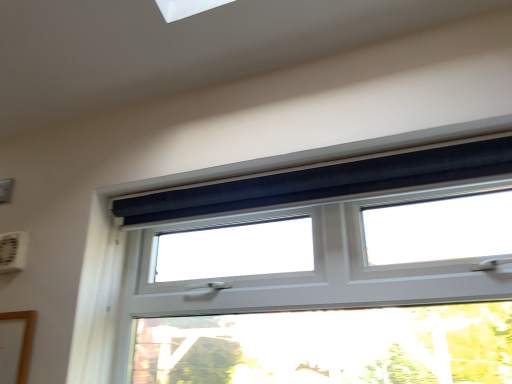
Measure the distance between point (1, 253) and camera.

Point (1, 253) and camera are 1.39 meters apart.

In order to face white plastic air conditioning unit at upper left, should I rotate leftwards or rightwards?

Rotate your view left by about 30.330°.

This screenshot has width=512, height=384. I want to click on white plastic air conditioning unit at upper left, so pyautogui.click(x=13, y=251).

This screenshot has width=512, height=384. What do you see at coordinates (13, 251) in the screenshot?
I see `white plastic air conditioning unit at upper left` at bounding box center [13, 251].

The image size is (512, 384). What are the coordinates of `black velvet curtain at upper center` in the screenshot? It's located at (323, 272).

Based on the photo, measure the distance between point (162,254) and camera.

A distance of 4.78 feet exists between point (162,254) and camera.

In order to face black velvet curtain at upper center, should I rotate leftwards or rightwards?

Rotate right and turn 5.885 degrees.

This screenshot has width=512, height=384. Describe the element at coordinates (323, 272) in the screenshot. I see `black velvet curtain at upper center` at that location.

Where is `white plastic air conditioning unit at upper left`? Image resolution: width=512 pixels, height=384 pixels. white plastic air conditioning unit at upper left is located at coordinates (13, 251).

Considering the positions of objects white plastic air conditioning unit at upper left and black velvet curtain at upper center in the image provided, who is more to the right, white plastic air conditioning unit at upper left or black velvet curtain at upper center?

From the viewer's perspective, black velvet curtain at upper center appears more on the right side.

Is white plastic air conditioning unit at upper left positioned in front of black velvet curtain at upper center?

No, white plastic air conditioning unit at upper left is further to the viewer.

Which point is more forward, [1,255] or [486,356]?

The point [486,356] is more forward.

From the image's perspective, who appears lower, white plastic air conditioning unit at upper left or black velvet curtain at upper center?

black velvet curtain at upper center is shown below in the image.

From a real-world perspective, which object rests below the other?

black velvet curtain at upper center, from a real-world perspective.

Which of these two, white plastic air conditioning unit at upper left or black velvet curtain at upper center, is wider?

With larger width is black velvet curtain at upper center.

In the scene shown: In terms of height, does white plastic air conditioning unit at upper left look taller or shorter compared to black velvet curtain at upper center?

Clearly, white plastic air conditioning unit at upper left is shorter compared to black velvet curtain at upper center.

Is white plastic air conditioning unit at upper left smaller than black velvet curtain at upper center?

Yes, white plastic air conditioning unit at upper left is smaller than black velvet curtain at upper center.

Choose the correct answer: Is white plastic air conditioning unit at upper left inside black velvet curtain at upper center or outside it?

white plastic air conditioning unit at upper left is located beyond the bounds of black velvet curtain at upper center.

Is the surface of white plastic air conditioning unit at upper left in direct contact with black velvet curtain at upper center?

white plastic air conditioning unit at upper left and black velvet curtain at upper center are not in contact.

Based on the photo, is white plastic air conditioning unit at upper left facing away from black velvet curtain at upper center?

white plastic air conditioning unit at upper left is not turned away from black velvet curtain at upper center.

Could you measure the distance between white plastic air conditioning unit at upper left and black velvet curtain at upper center?

They are 33.80 inches apart.

The width and height of the screenshot is (512, 384). I want to click on window below the white plastic air conditioning unit at upper left (from the image's perspective), so click(x=323, y=272).

Is black velvet curtain at upper center to the left or to the right of white plastic air conditioning unit at upper left in the image?

Based on their positions, black velvet curtain at upper center is located to the right of white plastic air conditioning unit at upper left.

In the scene shown: Which object is further away from the camera, black velvet curtain at upper center or white plastic air conditioning unit at upper left?

white plastic air conditioning unit at upper left is further from the camera.

Which is behind, point (248, 355) or point (23, 249)?

The point (23, 249) is farther.

From the image's perspective, is black velvet curtain at upper center located above or below white plastic air conditioning unit at upper left?

Based on their image positions, black velvet curtain at upper center is located beneath white plastic air conditioning unit at upper left.

From a real-world perspective, is black velvet curtain at upper center physically below white plastic air conditioning unit at upper left?

Yes, from a real-world perspective, black velvet curtain at upper center is below white plastic air conditioning unit at upper left.

Considering the sizes of objects black velvet curtain at upper center and white plastic air conditioning unit at upper left in the image provided, who is thinner, black velvet curtain at upper center or white plastic air conditioning unit at upper left?

white plastic air conditioning unit at upper left is thinner.

Does black velvet curtain at upper center have a lesser height compared to white plastic air conditioning unit at upper left?

Incorrect, the height of black velvet curtain at upper center does not fall short of that of white plastic air conditioning unit at upper left.

Who is bigger, black velvet curtain at upper center or white plastic air conditioning unit at upper left?

black velvet curtain at upper center is bigger.

Is white plastic air conditioning unit at upper left located within black velvet curtain at upper center?

No, white plastic air conditioning unit at upper left is not surrounded by black velvet curtain at upper center.

Are black velvet curtain at upper center and white plastic air conditioning unit at upper left located far from each other?

No, black velvet curtain at upper center is in close proximity to white plastic air conditioning unit at upper left.

Is black velvet curtain at upper center facing towards white plastic air conditioning unit at upper left?

No, black velvet curtain at upper center is not turned towards white plastic air conditioning unit at upper left.

You are a GUI agent. You are given a task and a screenshot of the screen. Output one action in this format:
    pyautogui.click(x=<x>, y=<y>)
    Task: Click on the air conditioning above the black velvet curtain at upper center (from the image's perspective)
    The width and height of the screenshot is (512, 384).
    Given the screenshot: What is the action you would take?
    pyautogui.click(x=13, y=251)

Find the location of `air conditioning lying above the black velvet curtain at upper center (from the image's perspective)`. air conditioning lying above the black velvet curtain at upper center (from the image's perspective) is located at coordinates (13, 251).

At what (x,y) coordinates should I click in order to perform the action: click on air conditioning behind the black velvet curtain at upper center. Please return your answer as a coordinate pair (x, y). Image resolution: width=512 pixels, height=384 pixels. Looking at the image, I should click on (13, 251).